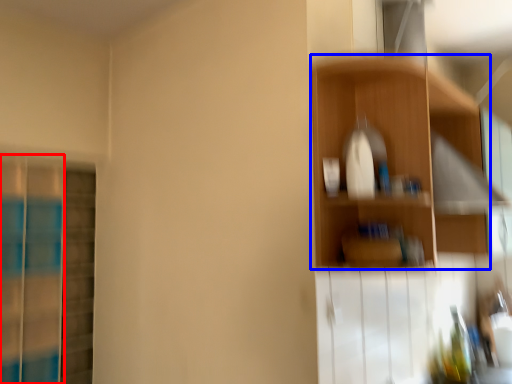
Question: Which object is closer to the camera taking this photo, screen door (highlighted by a red box) or shelf (highlighted by a blue box)?

Choices:
 (A) screen door
 (B) shelf

Answer: (B)